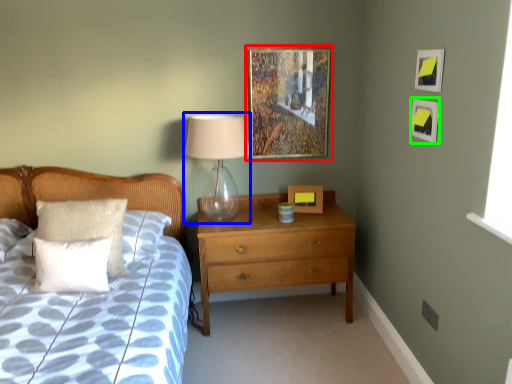
Question: Which is nearer to the picture frame (highlighted by a red box)? table lamp (highlighted by a blue box) or picture frame (highlighted by a green box).

Choices:
 (A) table lamp
 (B) picture frame

Answer: (A)